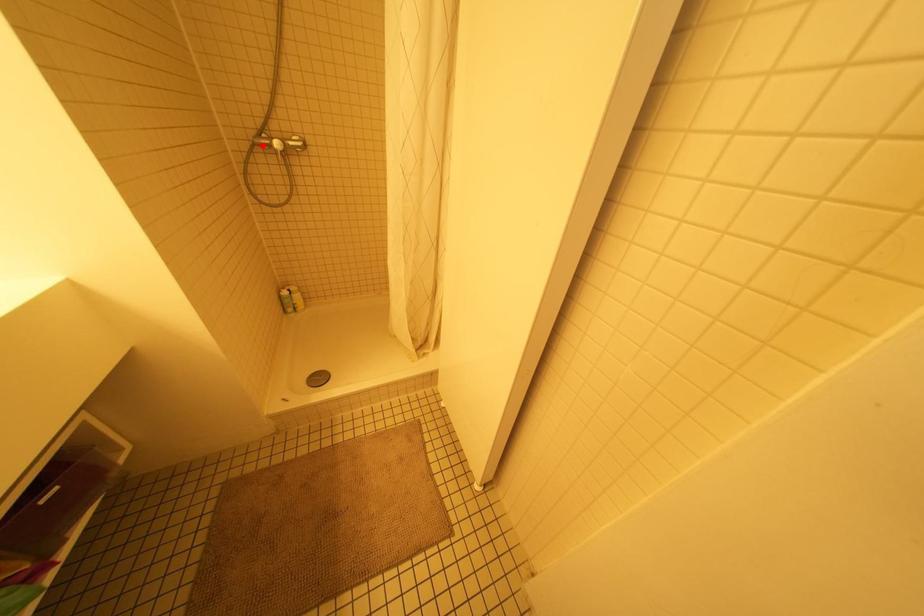
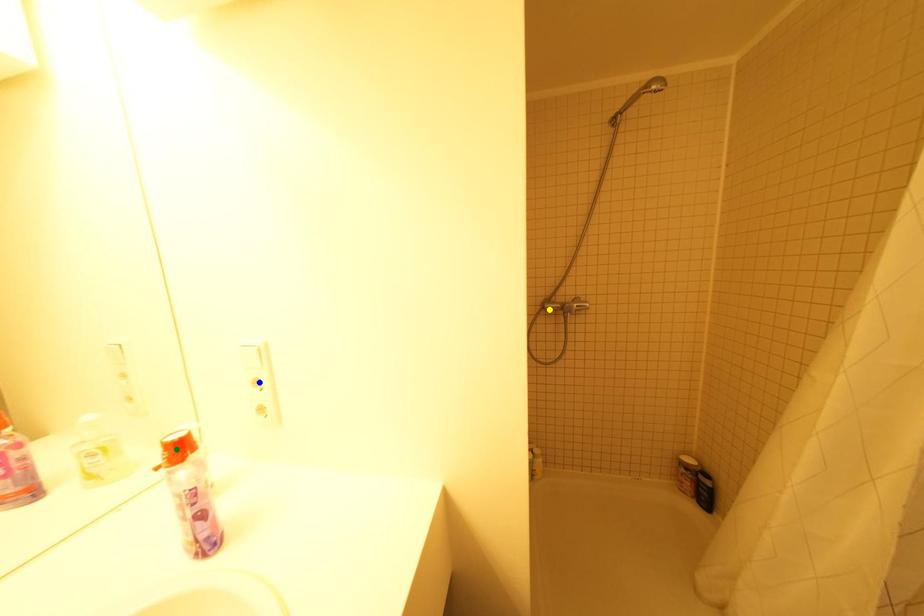
Question: I am providing you with two images of the same scene from different viewpoints. A red point is marked on the first image. You are given multiple points on the second image. Which point in image 2 represents the same 3d spot as the red point in image 1?

Choices:
 (A) green point
 (B) blue point
 (C) yellow point

Answer: (C)